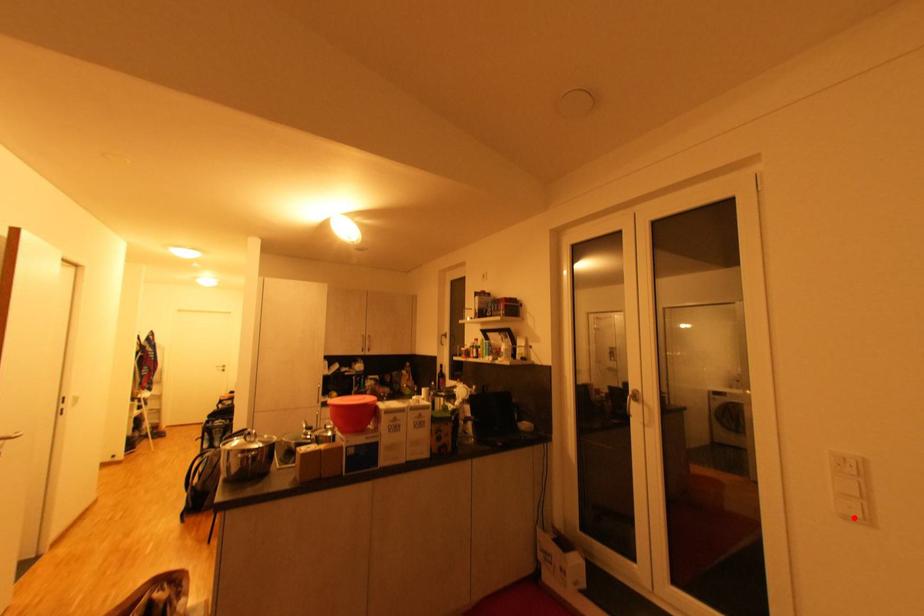
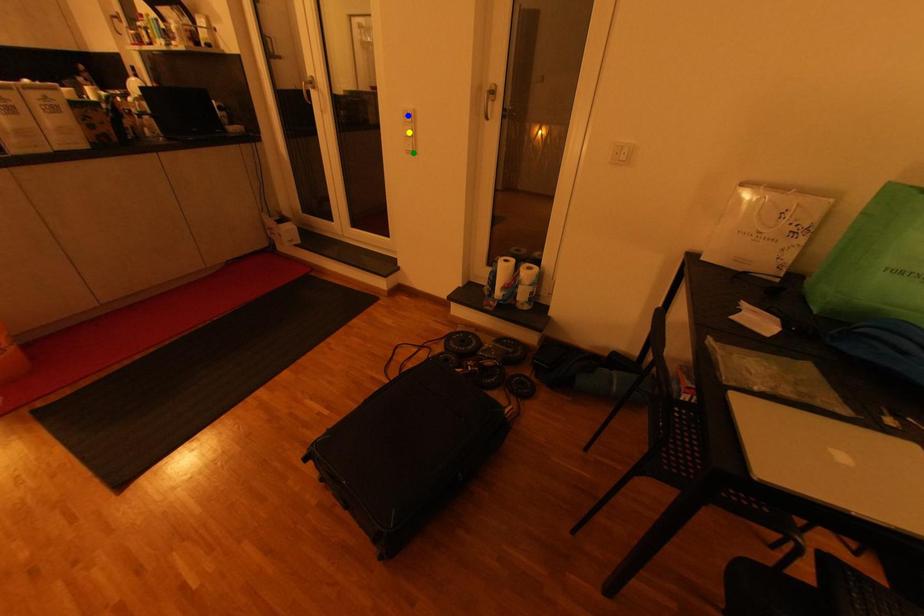
Question: I am providing you with two images of the same scene from different viewpoints. A red point is marked on the first image. You are given multiple points on the second image. Which point in image 2 is actually the same real-world point as the red point in image 1?

Choices:
 (A) blue point
 (B) yellow point
 (C) green point

Answer: (C)